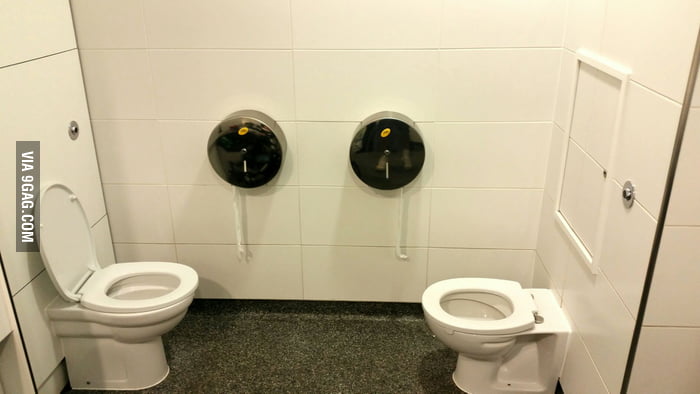
Locate an element on the screen. This screenshot has height=394, width=700. toilet is located at coordinates 125,309, 469,324.